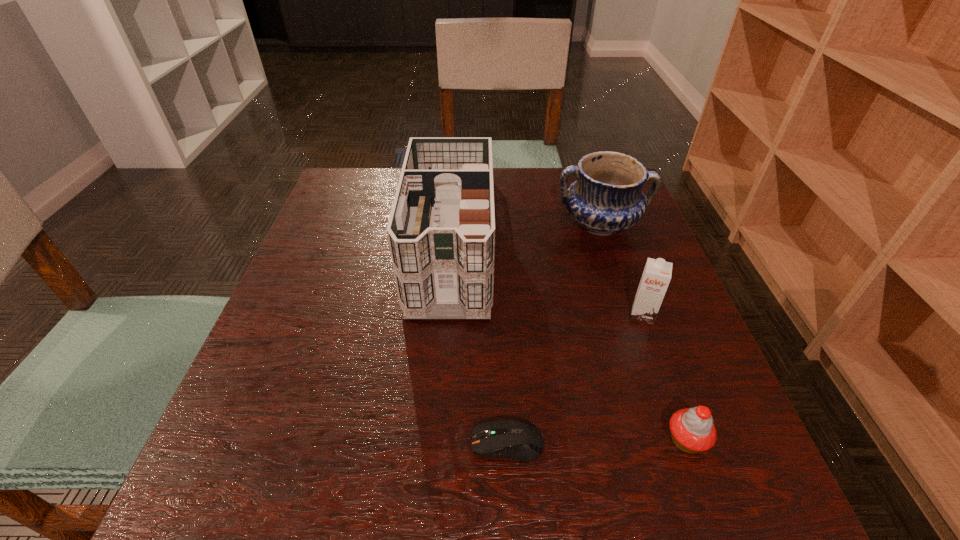
At what (x,y) coordinates should I click in order to perform the action: click on the tallest object. Please return your answer as a coordinate pair (x, y). Looking at the image, I should click on (441, 231).

Identify the location of the fourth shortest object. This screenshot has width=960, height=540. (607, 197).

Identify the location of chocolate milk. (656, 276).

Locate an element on the screen. This screenshot has width=960, height=540. the fourth tallest object is located at coordinates (692, 430).

You are a GUI agent. You are given a task and a screenshot of the screen. Output one action in this format:
    pyautogui.click(x=<x>, y=<y>)
    Task: Click on the computer equipment
    
    Given the screenshot: What is the action you would take?
    pyautogui.click(x=515, y=439)

You are a GUI agent. You are given a task and a screenshot of the screen. Output one action in this format:
    pyautogui.click(x=<x>, y=<y>)
    Task: Click on the free space located at the entrance of the tallest object
    The width and height of the screenshot is (960, 540).
    Given the screenshot: What is the action you would take?
    point(436,430)

Image resolution: width=960 pixels, height=540 pixels. What are the coordinates of `vacant space located 0.260m on the left of the pottery` in the screenshot? It's located at (450, 224).

Where is `free space located 0.140m on the left of the chocolate milk`? Image resolution: width=960 pixels, height=540 pixels. free space located 0.140m on the left of the chocolate milk is located at coordinates (558, 315).

I want to click on blank space located on the back of the fourth tallest object, so click(667, 388).

Where is `vacant space located 0.300m on the button of the computer equipment`? vacant space located 0.300m on the button of the computer equipment is located at coordinates (276, 443).